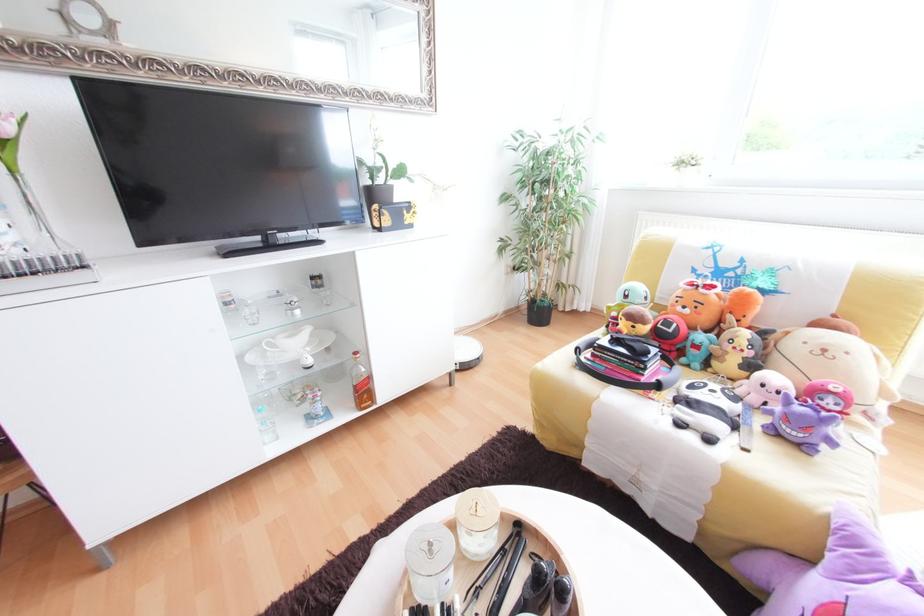
The image size is (924, 616). What do you see at coordinates (360, 383) in the screenshot?
I see `the red-labeled bottle` at bounding box center [360, 383].